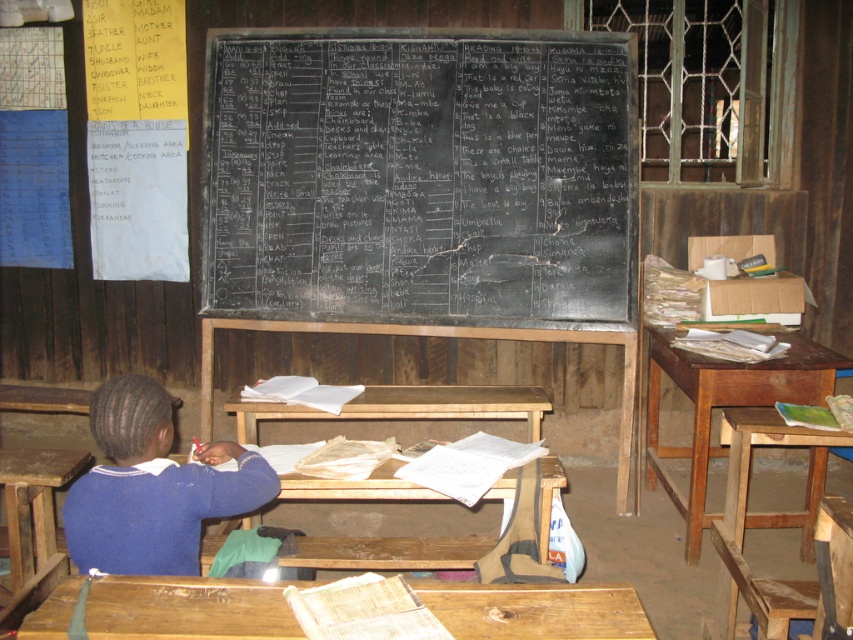
Does wooden table at center appear on the left side of wooden stool at lower right?

Correct, you'll find wooden table at center to the left of wooden stool at lower right.

Can you confirm if wooden table at center is shorter than wooden stool at lower right?

Yes, wooden table at center is shorter than wooden stool at lower right.

The height and width of the screenshot is (640, 853). Describe the element at coordinates (408, 406) in the screenshot. I see `wooden table at center` at that location.

Where is `wooden table at center`? The image size is (853, 640). wooden table at center is located at coordinates (408, 406).

Can you confirm if brown wooden table at right is wider than wooden table at center?

No.

Between point (730, 397) and point (390, 404), which one is positioned in front?

Point (730, 397)

Between point (650, 452) and point (473, 400), which one is positioned behind?

Point (650, 452)

The width and height of the screenshot is (853, 640). What are the coordinates of `brown wooden table at right` in the screenshot? It's located at (722, 406).

Can you confirm if black chalkboard at center is bigger than wooden stool at lower right?

Indeed, black chalkboard at center has a larger size compared to wooden stool at lower right.

Can you confirm if black chalkboard at center is wider than wooden stool at lower right?

Yes.

This screenshot has height=640, width=853. I want to click on black chalkboard at center, so click(x=421, y=177).

Identify the location of black chalkboard at center. (421, 177).